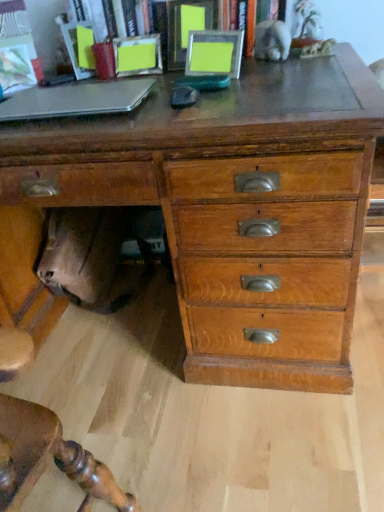
Question: Is wooden chest of drawers at center wider or thinner than metallic silver photo frames at upper center?

Choices:
 (A) wide
 (B) thin

Answer: (A)

Question: In terms of size, does wooden chest of drawers at center appear bigger or smaller than metallic silver photo frames at upper center?

Choices:
 (A) big
 (B) small

Answer: (A)

Question: Which of these objects is positioned farthest from the wooden chest of drawers at center?

Choices:
 (A) silver metallic laptop at left
 (B) metallic silver photo frames at upper center

Answer: (B)

Question: Which of these objects is positioned closest to the wooden chest of drawers at center?

Choices:
 (A) silver metallic laptop at left
 (B) metallic silver photo frames at upper center

Answer: (A)